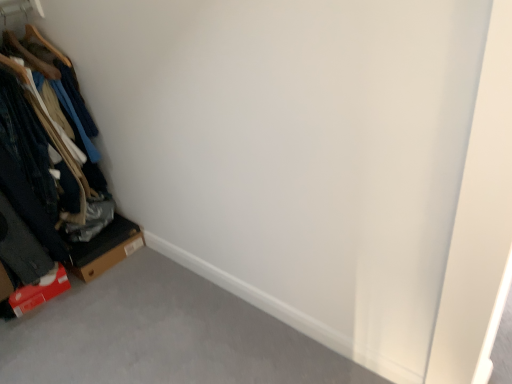
Question: Should I look upward or downward to see brown cardboard box at lower left?

Choices:
 (A) up
 (B) down

Answer: (B)

Question: Considering the relative positions of brown cardboard box at lower left and wooden hangers at left in the image provided, is brown cardboard box at lower left to the right of wooden hangers at left from the viewer's perspective?

Choices:
 (A) no
 (B) yes

Answer: (B)

Question: Is brown cardboard box at lower left closer to the viewer compared to wooden hangers at left?

Choices:
 (A) yes
 (B) no

Answer: (B)

Question: From the image's perspective, is brown cardboard box at lower left located beneath wooden hangers at left?

Choices:
 (A) yes
 (B) no

Answer: (A)

Question: Is brown cardboard box at lower left not close to wooden hangers at left?

Choices:
 (A) no
 (B) yes

Answer: (A)

Question: From a real-world perspective, is brown cardboard box at lower left positioned under wooden hangers at left based on gravity?

Choices:
 (A) no
 (B) yes

Answer: (B)

Question: Does brown cardboard box at lower left have a lesser height compared to wooden hangers at left?

Choices:
 (A) no
 (B) yes

Answer: (B)

Question: Is wooden hangers at left closer to camera compared to brown cardboard box at lower left?

Choices:
 (A) yes
 (B) no

Answer: (A)

Question: Does wooden hangers at left contain brown cardboard box at lower left?

Choices:
 (A) no
 (B) yes

Answer: (A)

Question: Is wooden hangers at left at the right side of brown cardboard box at lower left?

Choices:
 (A) yes
 (B) no

Answer: (B)

Question: Considering the relative sizes of wooden hangers at left and brown cardboard box at lower left in the image provided, is wooden hangers at left shorter than brown cardboard box at lower left?

Choices:
 (A) no
 (B) yes

Answer: (A)

Question: From the image's perspective, would you say wooden hangers at left is shown under brown cardboard box at lower left?

Choices:
 (A) no
 (B) yes

Answer: (A)

Question: From the image's perspective, is wooden hangers at left above brown cardboard box at lower left?

Choices:
 (A) no
 (B) yes

Answer: (B)

Question: In the image, is wooden hangers at left positioned in front of or behind brown cardboard box at lower left?

Choices:
 (A) front
 (B) behind

Answer: (A)